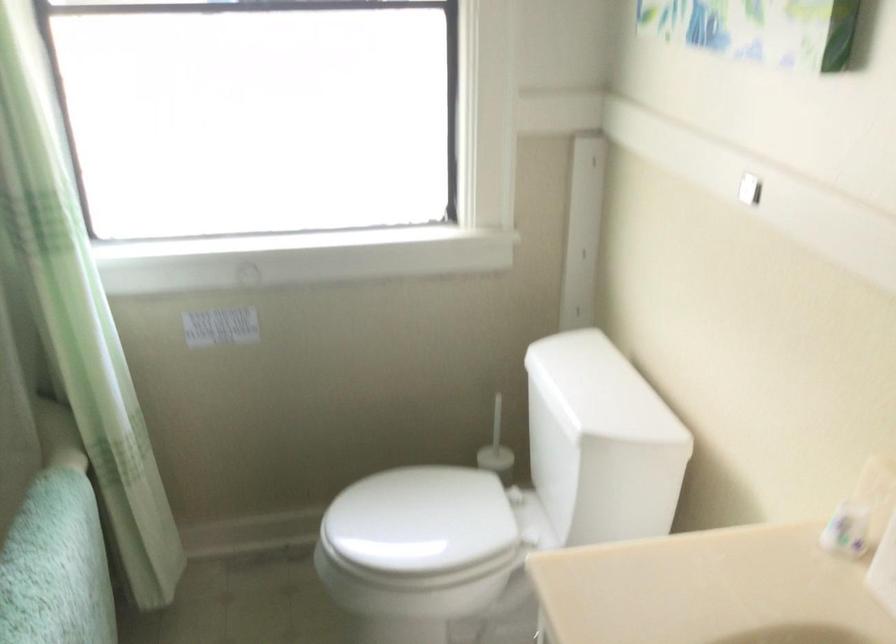
I want to click on white toilet lid, so click(x=599, y=390).